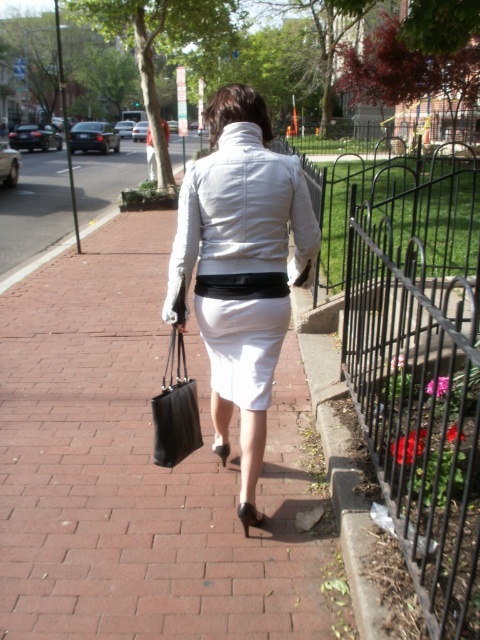
You are a fashion designer observing the woman from behind. You notice two skirts on her, the white matte skirt at center and the white cotton pencil skirt at center. Which one is closer to the camera?

Both skirts are part of the same outfit, so they are at the same distance from the camera. However, the white cotton pencil skirt at center is slightly closer because it is layered over the white matte skirt at center.

You are standing at the point marked by the coordinates point (241, 268) in the image. What object is located exactly at that point?

The point (241, 268) marks the white matte skirt at center.